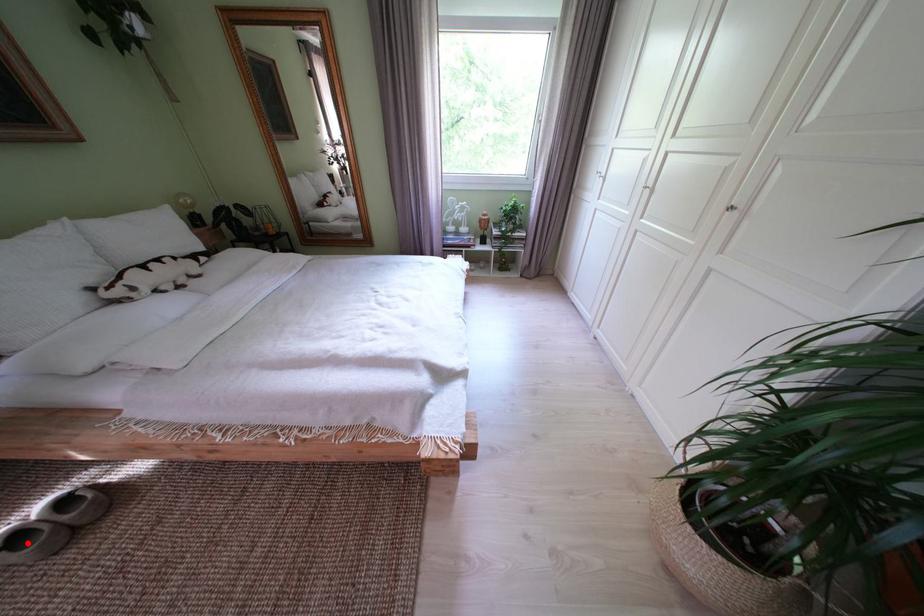
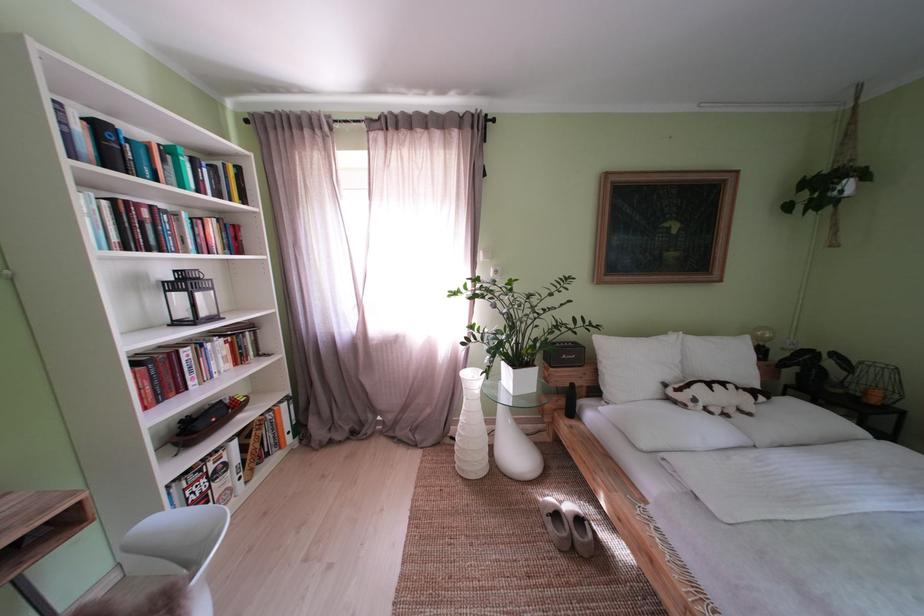
Question: I am providing you with two images of the same scene from different viewpoints. Image1 has a red point marked. In image2, the corresponding 3D location appears at what relative position? Reply with the corresponding letter.

Choices:
 (A) Closer
 (B) Farther

Answer: (B)